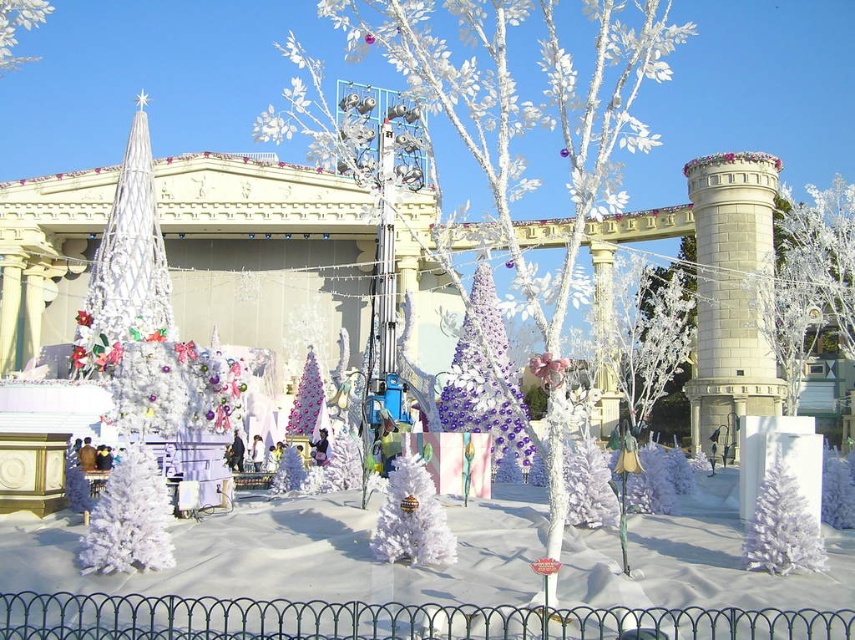
Question: Which object is positioned closest to the white stone tower at center right?

Choices:
 (A) white matte christmas tree at center
 (B) shiny purple tinsel tree at center
 (C) pink glittery tree at center
 (D) white matte tree at lower left

Answer: (B)

Question: Can you confirm if white stone tower at center right is positioned above shiny purple tinsel tree at center?

Choices:
 (A) yes
 (B) no

Answer: (A)

Question: Is shiny purple tinsel tree at center thinner than white matte christmas tree at lower right?

Choices:
 (A) yes
 (B) no

Answer: (B)

Question: Does white matte tree at lower left come behind white matte christmas tree at lower right?

Choices:
 (A) yes
 (B) no

Answer: (B)

Question: Which point is farther to the camera?

Choices:
 (A) white matte christmas tree at center
 (B) white matte tree at upper left

Answer: (B)

Question: Which of the following is the closest to the observer?

Choices:
 (A) (0, 36)
 (B) (302, 404)

Answer: (A)